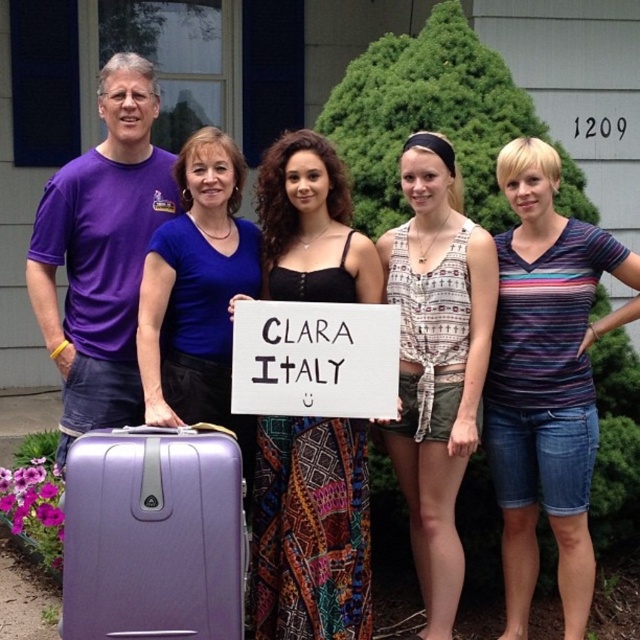
You are a photographer trying to adjust the spacing between the patterned fabric tank top at center and the white paper sign at center for a better composition. The current distance between them is 42.04 centimeters. If you want to reduce the distance by half, what should the new distance be?

The current distance between the patterned fabric tank top at center and the white paper sign at center is 42.04 centimeters. To reduce it by half, the new distance should be 21.02 centimeters.

You are standing in front of the house with the number 1209. You need to deliver a package to the person wearing the striped cotton shirt at center and the matte purple suitcase at left. Which item should you hand the package to first, based on their positions?

The striped cotton shirt at center is closer to you than the matte purple suitcase at left, so you should hand the package to the striped cotton shirt at center first.

Please describe the object located at point (310, 531) in the image.

The object at point (310, 531) is a black textured dress at center.